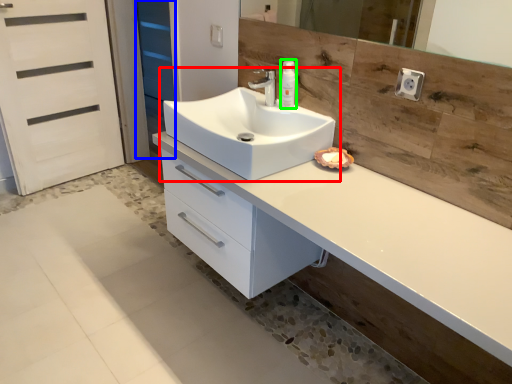
Question: Considering the real-world distances, which object is farthest from sink (highlighted by a red box)? screen door (highlighted by a blue box) or soap dispenser (highlighted by a green box)?

Choices:
 (A) screen door
 (B) soap dispenser

Answer: (A)